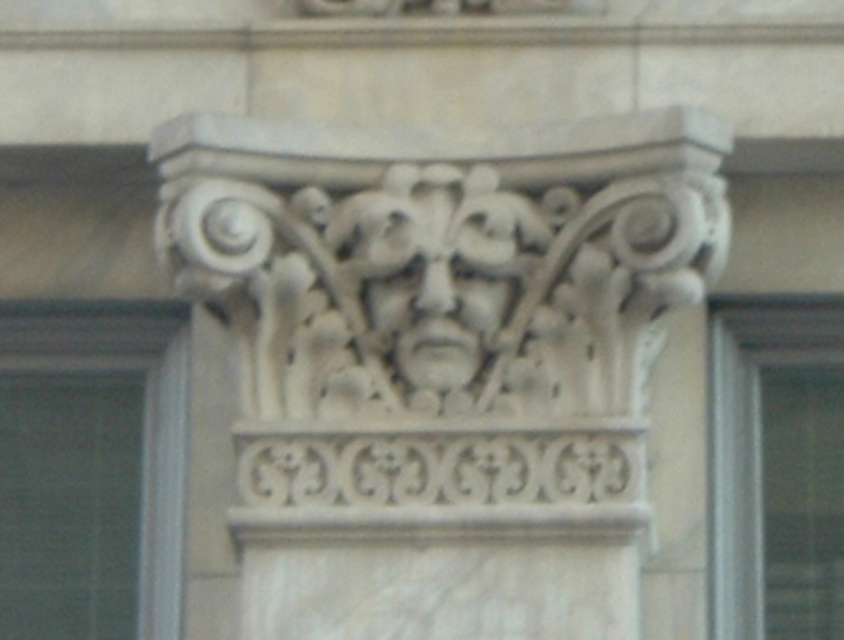
Can you confirm if white stone carving at center is taller than white stone face at center?

Yes.

Does white stone carving at center have a greater width compared to white stone face at center?

Correct, the width of white stone carving at center exceeds that of white stone face at center.

You are a GUI agent. You are given a task and a screenshot of the screen. Output one action in this format:
    pyautogui.click(x=<x>, y=<y>)
    Task: Click on the white stone carving at center
    This screenshot has height=640, width=844.
    Given the screenshot: What is the action you would take?
    pyautogui.click(x=442, y=358)

In order to click on white stone carving at center in this screenshot , I will do `click(442, 358)`.